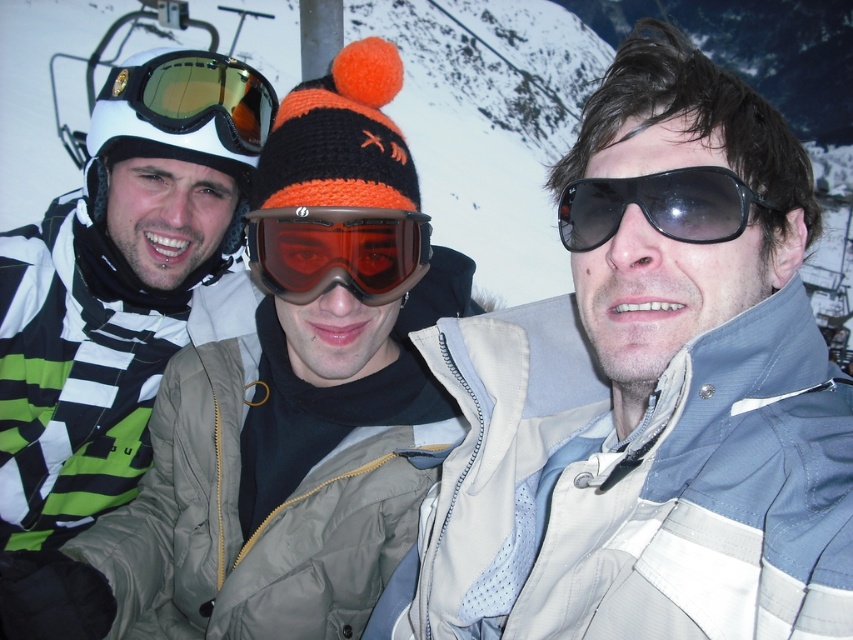
You are trying to decide which eyewear to purchase based on size preferences. The gold reflective lens goggles at upper left and the black matte sunglasses at center are both available. If you prefer larger eyewear, which one should you choose?

The gold reflective lens goggles at upper left is larger in size than the black matte sunglasses at center, so you should choose the gold reflective lens goggles at upper left if you prefer larger eyewear.

You are a photographer trying to capture the best shot of the two people in the center. You notice the translucent orange ski goggles at center and the black matte sunglasses at center. Which one is positioned lower on their face?

The translucent orange ski goggles at center is below black matte sunglasses at center, so the goggles are positioned lower on their face than the sunglasses.

Based on the scene description, which of the two goggles, the translucent orange ski goggles at center or the gold reflective lens goggles at upper left, is positioned higher in the image?

The gold reflective lens goggles at upper left is positioned higher in the image than the translucent orange ski goggles at center.